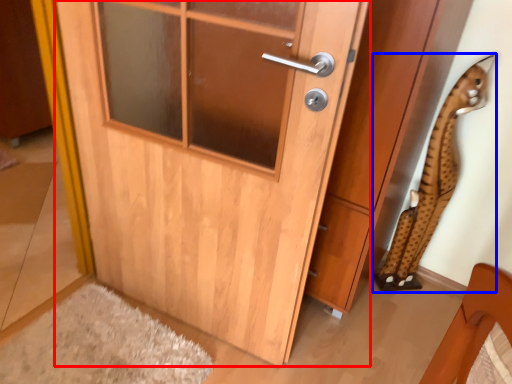
Question: Which object appears closest to the camera in this image, door (highlighted by a red box) or animal (highlighted by a blue box)?

Choices:
 (A) door
 (B) animal

Answer: (A)